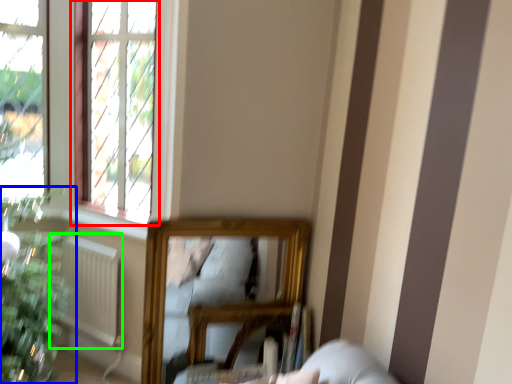
Question: Which is nearer to the window (highlighted by a red box)? houseplant (highlighted by a blue box) or radiator (highlighted by a green box).

Choices:
 (A) houseplant
 (B) radiator

Answer: (B)